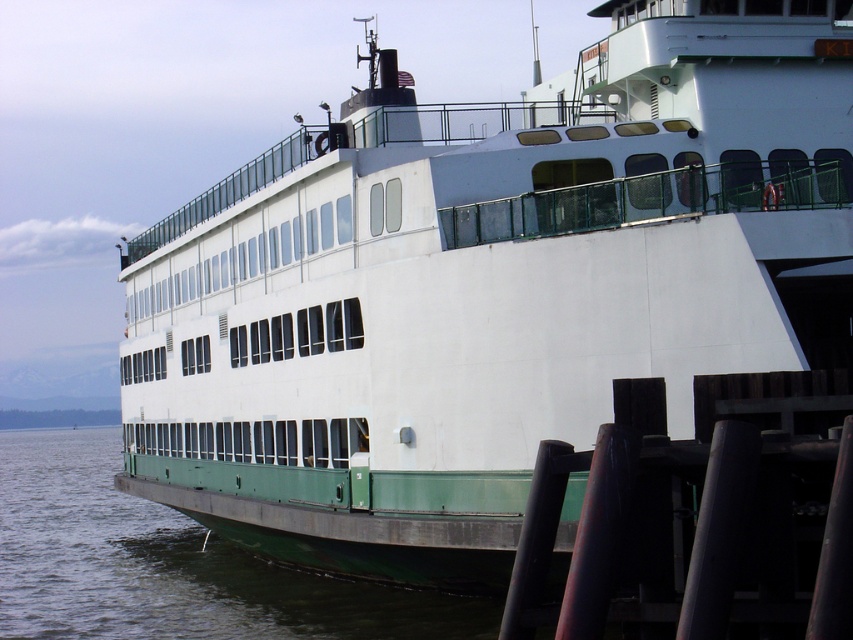
You are a photographer standing on the ferry and want to capture the wooden pier and the water in one shot. Since you have a wide angle lens, you need to know which object is thinner to frame your shot properly. Which is thinner between the dark brown wooden posts at lower right and the green matte water at lower left?

The dark brown wooden posts at lower right is thinner than the green matte water at lower left according to the description.

You are a passenger on the ferry and want to walk from the front of the ferry to the wooden pier. Which object from the scene would you step onto first, the dark brown wooden posts at lower right or the green matte water at lower left?

You would step onto the dark brown wooden posts at lower right first because it is positioned over the green matte water at lower left, meaning the posts are above the water level.